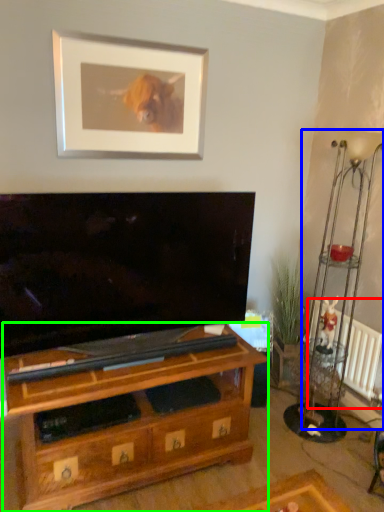
Question: Based on their relative distances, which object is farther from radiator (highlighted by a red box)? Choose from lamp (highlighted by a blue box) and shelf (highlighted by a green box).

Choices:
 (A) lamp
 (B) shelf

Answer: (B)